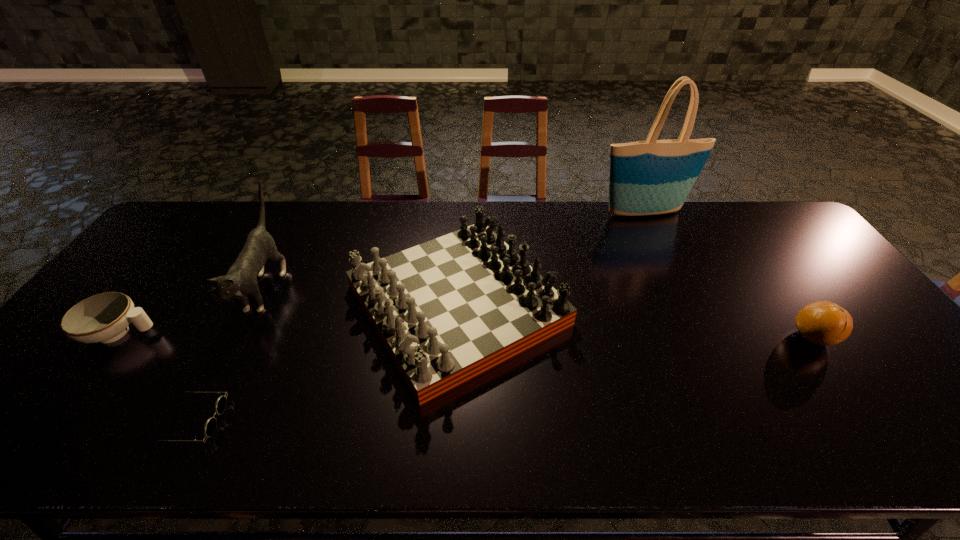
Find the location of `the second object from right to left`. the second object from right to left is located at coordinates (651, 177).

Locate an element on the screen. Image resolution: width=960 pixels, height=540 pixels. the tallest object is located at coordinates (651, 177).

This screenshot has height=540, width=960. Identify the location of the fifth shortest object. (241, 279).

The height and width of the screenshot is (540, 960). I want to click on the third tallest object, so click(x=446, y=310).

The image size is (960, 540). In order to click on the fourth object from left to right in this screenshot , I will do `click(446, 310)`.

Where is `the rightmost object`? the rightmost object is located at coordinates (825, 323).

Find the location of a particular element. the third shortest object is located at coordinates (825, 323).

This screenshot has width=960, height=540. In order to click on the second shortest object in this screenshot , I will do `click(104, 318)`.

I want to click on chinaware, so click(x=104, y=318).

The image size is (960, 540). Find the location of `sunglasses`. sunglasses is located at coordinates (210, 426).